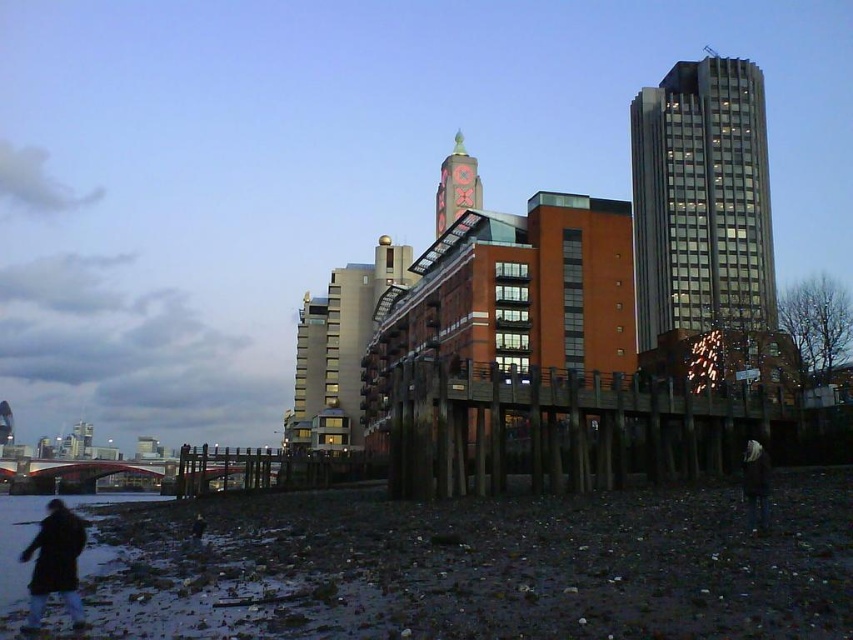
Can you confirm if dark brown coat at lower left is positioned to the right of brick tower at center?

No, dark brown coat at lower left is not to the right of brick tower at center.

What do you see at coordinates (55, 564) in the screenshot? The height and width of the screenshot is (640, 853). I see `dark brown coat at lower left` at bounding box center [55, 564].

You are a GUI agent. You are given a task and a screenshot of the screen. Output one action in this format:
    pyautogui.click(x=<x>, y=<y>)
    Task: Click on the dark brown coat at lower left
    
    Given the screenshot: What is the action you would take?
    pyautogui.click(x=55, y=564)

Based on the photo, is matte glass skyscraper at upper right smaller than brick tower at center?

Actually, matte glass skyscraper at upper right might be larger than brick tower at center.

You are a GUI agent. You are given a task and a screenshot of the screen. Output one action in this format:
    pyautogui.click(x=<x>, y=<y>)
    Task: Click on the matte glass skyscraper at upper right
    The height and width of the screenshot is (640, 853).
    Given the screenshot: What is the action you would take?
    pyautogui.click(x=701, y=204)

Is point (71, 561) positioned after point (766, 460)?

No, it is not.

Between point (73, 609) and point (753, 525), which one is positioned behind?

Point (753, 525)

Image resolution: width=853 pixels, height=640 pixels. What are the coordinates of `dark brown coat at lower left` in the screenshot? It's located at (55, 564).